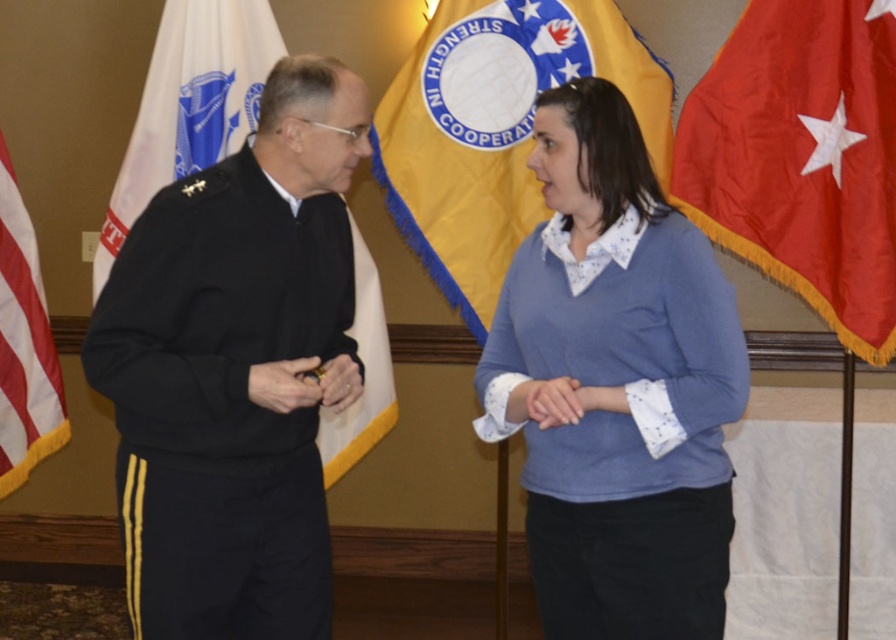
Who is positioned more to the right, matte black uniform at center or matte blue sweater at center?

matte blue sweater at center is more to the right.

Is point (311, 394) farther from viewer compared to point (553, 406)?

Yes.

The image size is (896, 640). What do you see at coordinates (283, 385) in the screenshot?
I see `matte black uniform at center` at bounding box center [283, 385].

You are a GUI agent. You are given a task and a screenshot of the screen. Output one action in this format:
    pyautogui.click(x=<x>, y=<y>)
    Task: Click on the matte black uniform at center
    
    Given the screenshot: What is the action you would take?
    pyautogui.click(x=283, y=385)

Does red fabric flag at right come behind matte black uniform at center?

Yes, it is behind matte black uniform at center.

Consider the image. Is red fabric flag at right taller than matte black uniform at center?

Indeed, red fabric flag at right has a greater height compared to matte black uniform at center.

The height and width of the screenshot is (640, 896). Identify the location of red fabric flag at right. (802, 157).

Who is positioned more to the right, black uniform at left or matte blue sweater at center?

matte blue sweater at center

Image resolution: width=896 pixels, height=640 pixels. I want to click on black uniform at left, so (231, 369).